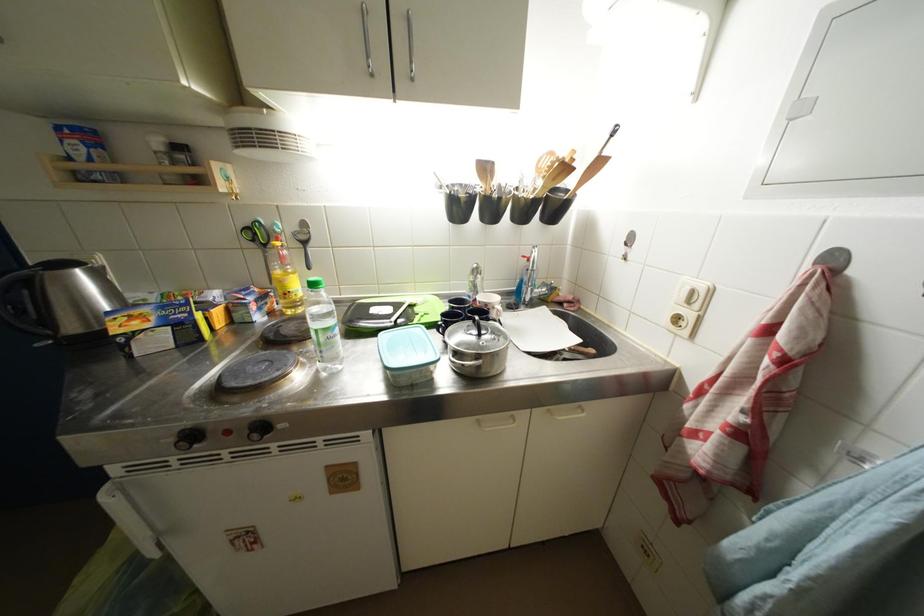
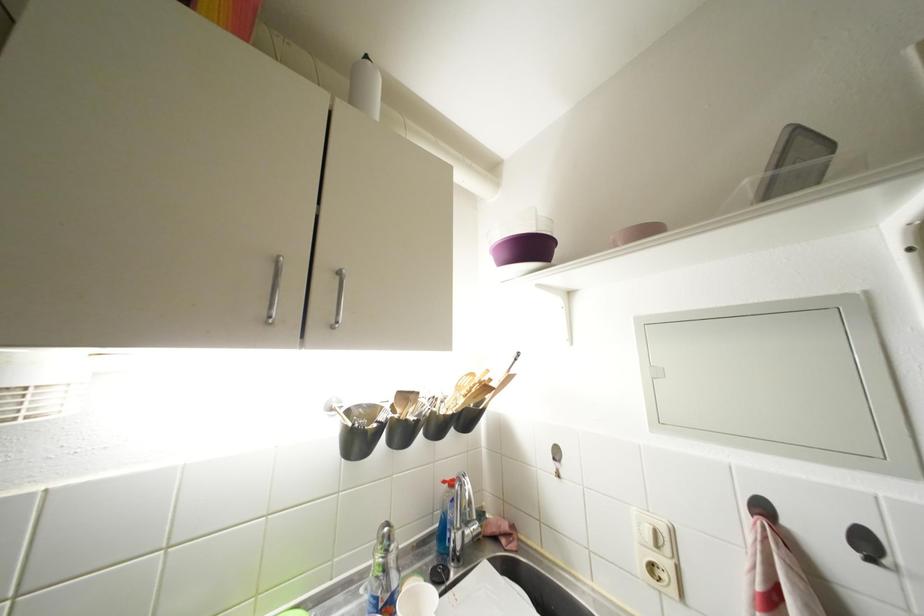
Where in the second image is the point corresponding to the point at 629,254 from the first image?

(560, 469)